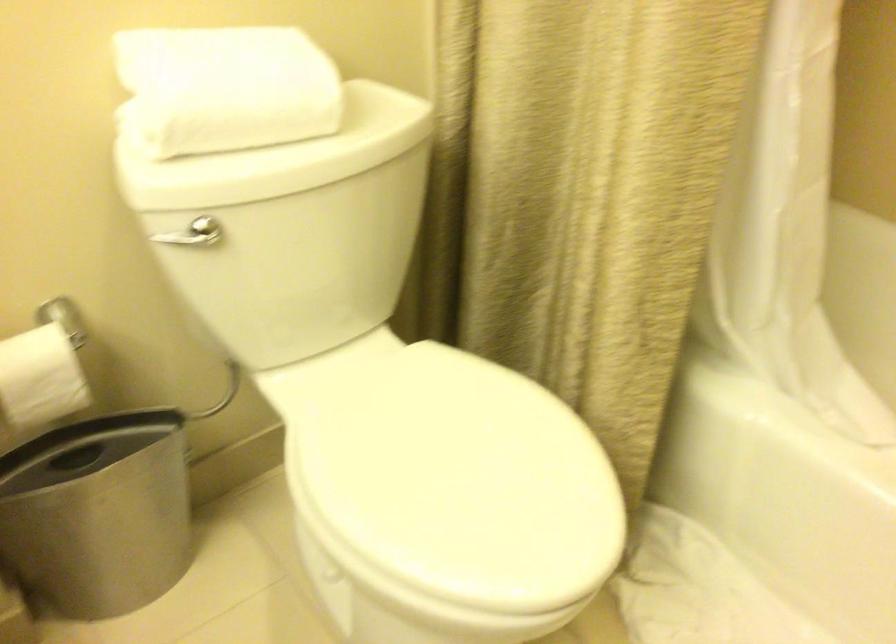
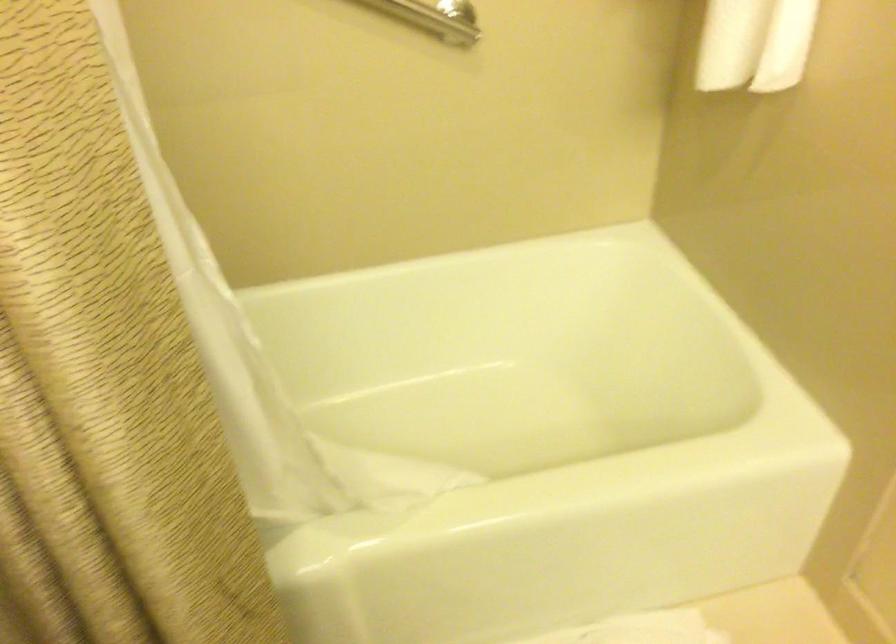
Question: The images are taken continuously from a first-person perspective. In which direction is your viewpoint rotating?

Choices:
 (A) Left
 (B) Right
 (C) Up
 (D) Down

Answer: (B)